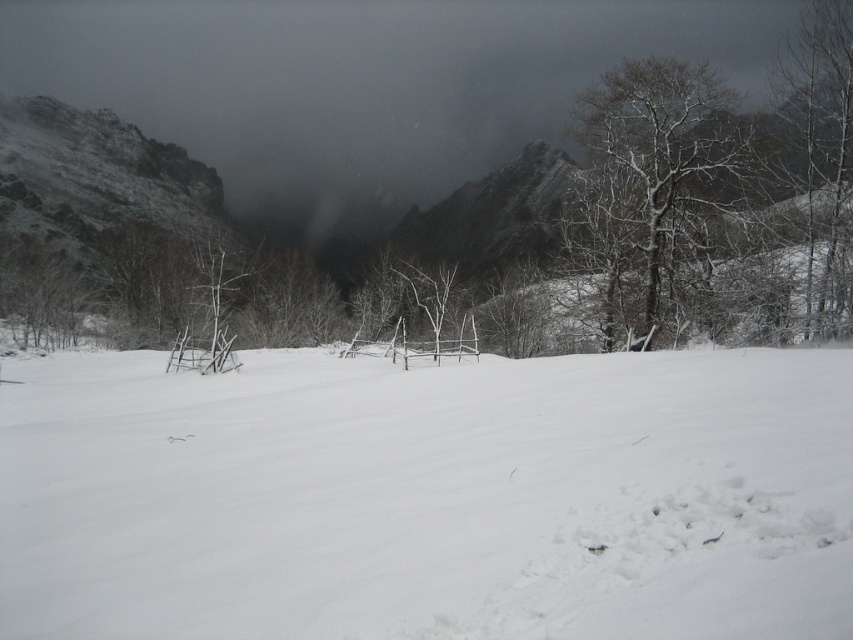
Question: Does white snow at center have a smaller size compared to snow-covered tree at upper right?

Choices:
 (A) yes
 (B) no

Answer: (A)

Question: Can you confirm if snow-covered tree at upper right is positioned to the right of white matte tree at upper right?

Choices:
 (A) no
 (B) yes

Answer: (A)

Question: Among these points, which one is farthest from the camera?

Choices:
 (A) (634, 67)
 (B) (138, 596)

Answer: (A)

Question: Can you confirm if snow-covered tree at upper right is thinner than white matte tree at upper right?

Choices:
 (A) yes
 (B) no

Answer: (B)

Question: Which is nearer to the snow-covered tree at upper right?

Choices:
 (A) white matte tree at upper right
 (B) white snow at center

Answer: (A)

Question: Which of the following is the closest to the observer?

Choices:
 (A) snow-covered tree at upper right
 (B) white snow at center
 (C) white matte tree at upper right

Answer: (B)